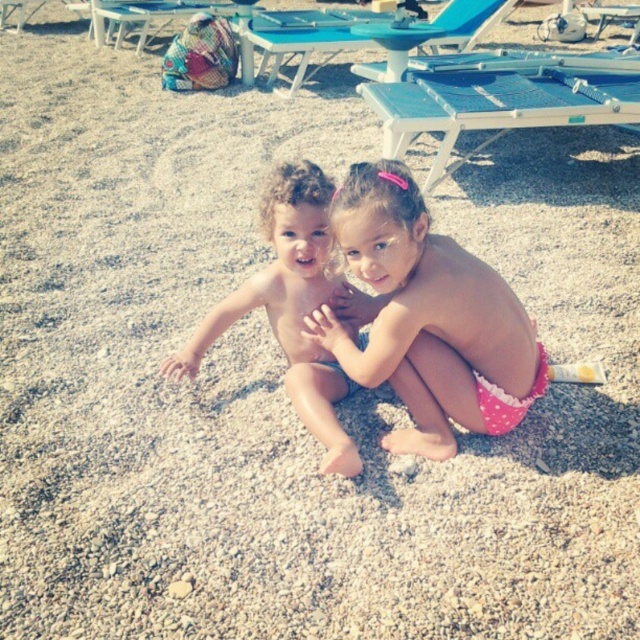
Question: Does pink polka dot swimsuit at center have a smaller size compared to multicolored woven bag at upper left?

Choices:
 (A) no
 (B) yes

Answer: (B)

Question: Estimate the real-world distances between objects in this image. Which object is closer to the multicolored woven bag at upper left?

Choices:
 (A) pink polka dot swimsuit at center
 (B) smooth skin children at center

Answer: (B)

Question: Can you confirm if pink polka dot swimsuit at center is positioned below smooth skin children at center?

Choices:
 (A) no
 (B) yes

Answer: (A)

Question: Which of these objects is positioned closest to the pink polka dot swimsuit at center?

Choices:
 (A) smooth skin children at center
 (B) multicolored woven bag at upper left

Answer: (A)

Question: Based on their relative distances, which object is nearer to the pink polka dot swimsuit at center?

Choices:
 (A) smooth skin children at center
 (B) multicolored woven bag at upper left

Answer: (A)

Question: Does pink polka dot swimsuit at center have a smaller size compared to smooth skin children at center?

Choices:
 (A) yes
 (B) no

Answer: (B)